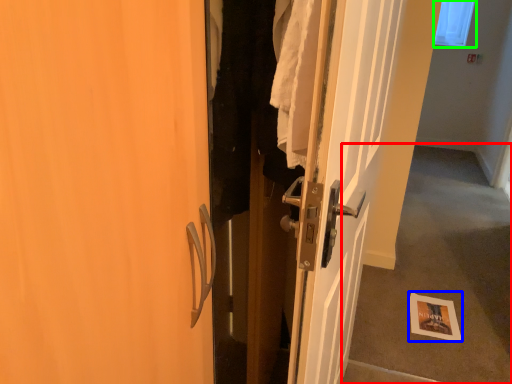
Question: Which object is positioned farthest from corridor (highlighted by a red box)? Select from postcard (highlighted by a blue box) and window screen (highlighted by a green box).

Choices:
 (A) postcard
 (B) window screen

Answer: (B)